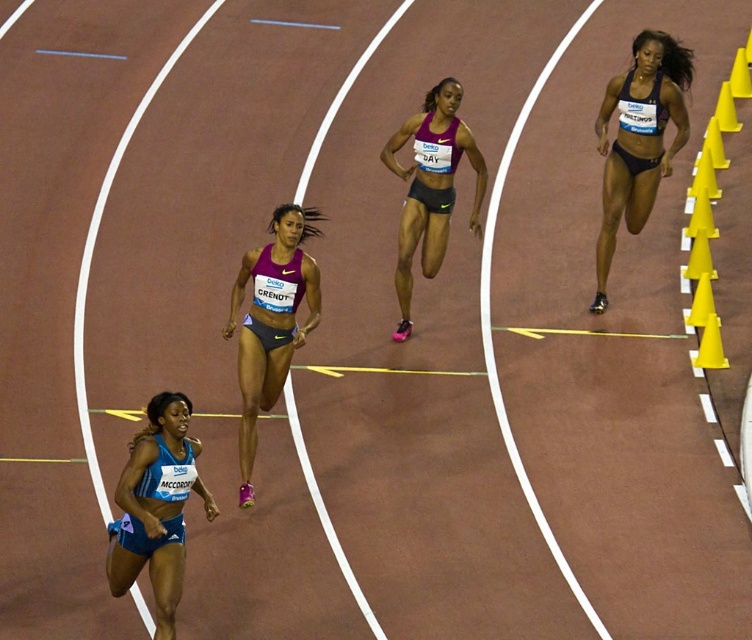
You are a photographer at the track and field event. You want to capture a closeup shot of the athlete wearing the matte purple tank top at center and the purple matte shorts at center. Which piece of clothing will appear narrower in the photo?

The matte purple tank top at center is thinner than the purple matte shorts at center, so the matte purple tank top at center will appear narrower in the photo.

You are a photographer positioned at the starting line of the indoor track. You want to capture a photo of the athlete wearing the dark blue fabric shorts at right. Given that your camera has a maximum focus range of 10 meters, will you be able to clearly capture the athlete?

The dark blue fabric shorts at right and viewer are 9.84 meters apart from each other. Since 9.84 meters is within the camera maximum focus range of 10 meters, the photographer can clearly capture the athlete wearing the dark blue fabric shorts at right.